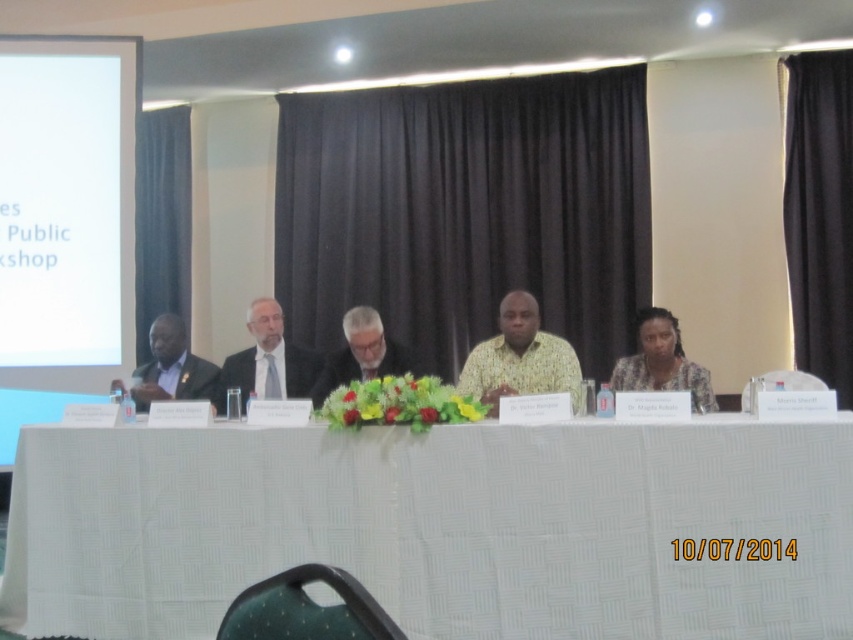
You are a photographer positioned at the camera. You need to adjust your lens to focus on the matte black dress at center. The dress is 3.50 meters away. What is the minimum distance your lens needs to be able to focus at to capture the dress clearly?

The minimum focusing distance required is 3.50 meters, as the matte black dress at center is exactly 3.50 meters away from the camera.

You are sitting at the long table in the formal setting. You notice two points marked on the floor. One is at coordinates point (639,323) and the other at point (183,392). Which point is closer to your current position at the table?

Point (639,323) is in front of point (183,392), so it is closer to your current position at the table.

You are attending a formal event and notice two items in the image. One is the black fabric curtain at right and the other is the matte black dress at center. Which of these items is positioned higher relative to the other?

The black fabric curtain at right is located above the matte black dress at center, so it is positioned higher.